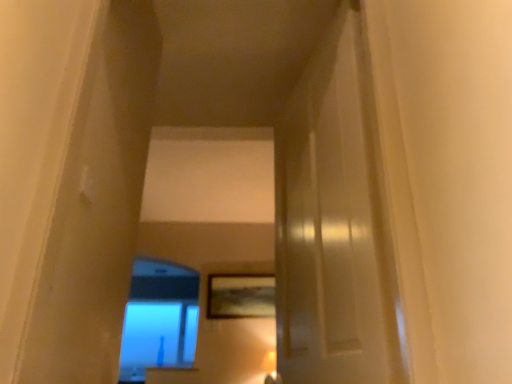
Question: Is wooden textured picture frame at center behind blue glass window at lower left?

Choices:
 (A) yes
 (B) no

Answer: (B)

Question: Does wooden textured picture frame at center appear on the left side of blue glass window at lower left?

Choices:
 (A) yes
 (B) no

Answer: (B)

Question: Would you say wooden textured picture frame at center contains blue glass window at lower left?

Choices:
 (A) no
 (B) yes

Answer: (A)

Question: Is wooden textured picture frame at center in front of blue glass window at lower left?

Choices:
 (A) yes
 (B) no

Answer: (A)

Question: Is wooden textured picture frame at center touching blue glass window at lower left?

Choices:
 (A) yes
 (B) no

Answer: (B)

Question: Is wooden textured picture frame at center not inside blue glass window at lower left?

Choices:
 (A) yes
 (B) no

Answer: (A)

Question: Is blue glass window at lower left surrounding wooden textured picture frame at center?

Choices:
 (A) no
 (B) yes

Answer: (A)

Question: From the image's perspective, is blue glass window at lower left on top of wooden textured picture frame at center?

Choices:
 (A) yes
 (B) no

Answer: (B)

Question: Does blue glass window at lower left have a greater width compared to wooden textured picture frame at center?

Choices:
 (A) yes
 (B) no

Answer: (A)

Question: From the image's perspective, is blue glass window at lower left beneath wooden textured picture frame at center?

Choices:
 (A) no
 (B) yes

Answer: (B)

Question: Are blue glass window at lower left and wooden textured picture frame at center making contact?

Choices:
 (A) yes
 (B) no

Answer: (B)

Question: Are blue glass window at lower left and wooden textured picture frame at center located far from each other?

Choices:
 (A) yes
 (B) no

Answer: (B)

Question: In the image, is wooden textured picture frame at center positioned in front of or behind blue glass window at lower left?

Choices:
 (A) behind
 (B) front

Answer: (B)